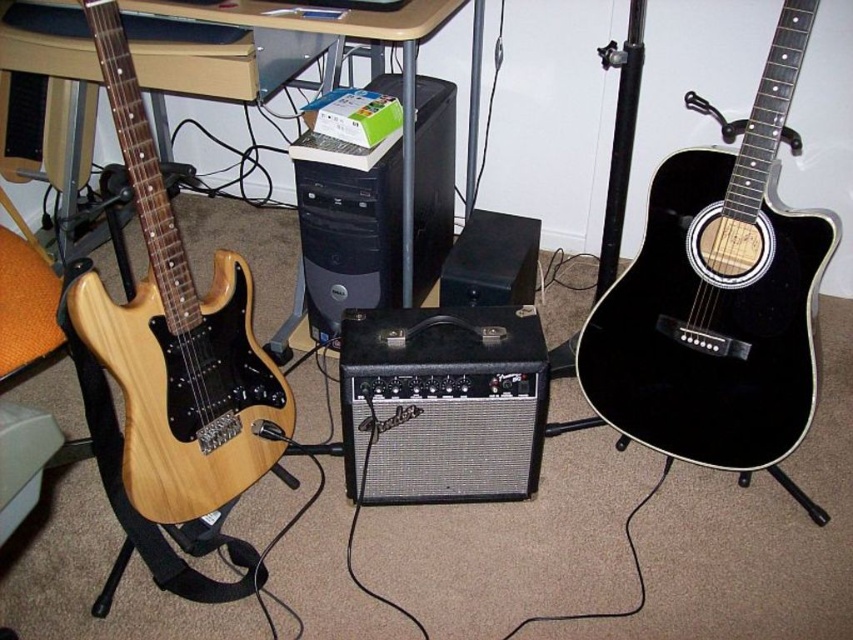
Question: Based on their relative distances, which object is farther from the black matte speaker at center?

Choices:
 (A) black mesh speaker at center
 (B) black glossy acoustic guitar at right
 (C) black plastic computer tower at center
 (D) natural wood electric guitar at left

Answer: (D)

Question: Which of the following is the farthest from the observer?

Choices:
 (A) black matte speaker at center
 (B) natural wood electric guitar at left
 (C) black glossy acoustic guitar at right
 (D) black plastic computer tower at center

Answer: (A)

Question: Does natural wood electric guitar at left have a smaller size compared to black matte speaker at center?

Choices:
 (A) yes
 (B) no

Answer: (B)

Question: Does black glossy acoustic guitar at right have a smaller size compared to natural wood electric guitar at left?

Choices:
 (A) no
 (B) yes

Answer: (A)

Question: Which of these objects is positioned closest to the black mesh speaker at center?

Choices:
 (A) natural wood electric guitar at left
 (B) black plastic computer tower at center
 (C) black glossy acoustic guitar at right

Answer: (A)

Question: Can you confirm if natural wood electric guitar at left is positioned below black mesh speaker at center?

Choices:
 (A) no
 (B) yes

Answer: (A)